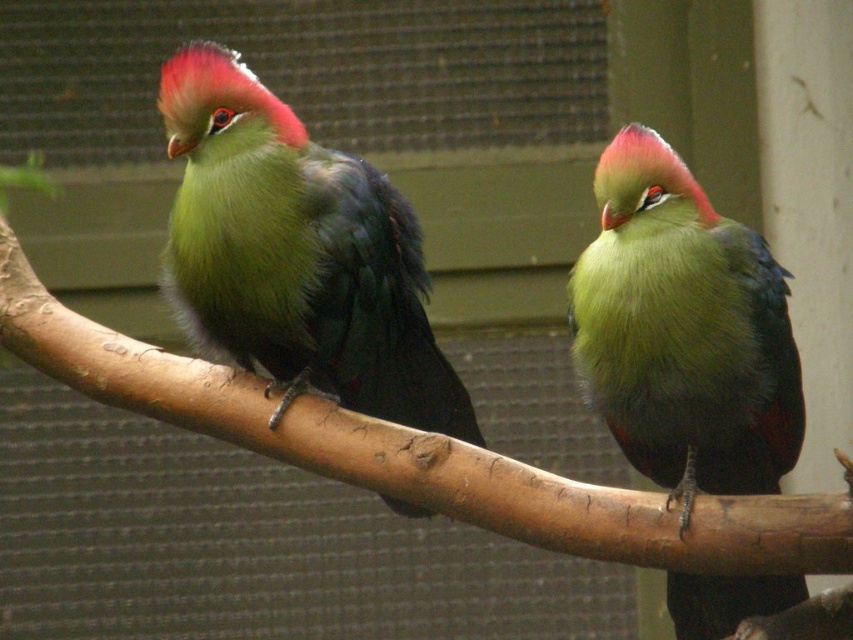
You are a birdwatcher observing two birds on a curved wooden branch. You notice a point marked at coordinates (683, 332). Which bird is located at this point?

The green matte parrot at center is located at point (683, 332).

You are a bird enthusiast observing two birds in an aviary. You notice the lime green feathers at center and the green matte parrot at center. Which of these has a larger size?

The lime green feathers at center has a larger size compared to the green matte parrot at center.